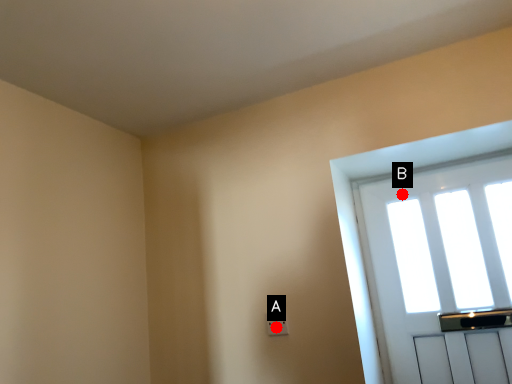
Question: Two points are circled on the image, labeled by A and B beside each circle. Among these points, which one is nearest to the camera?

Choices:
 (A) A is closer
 (B) B is closer

Answer: (A)